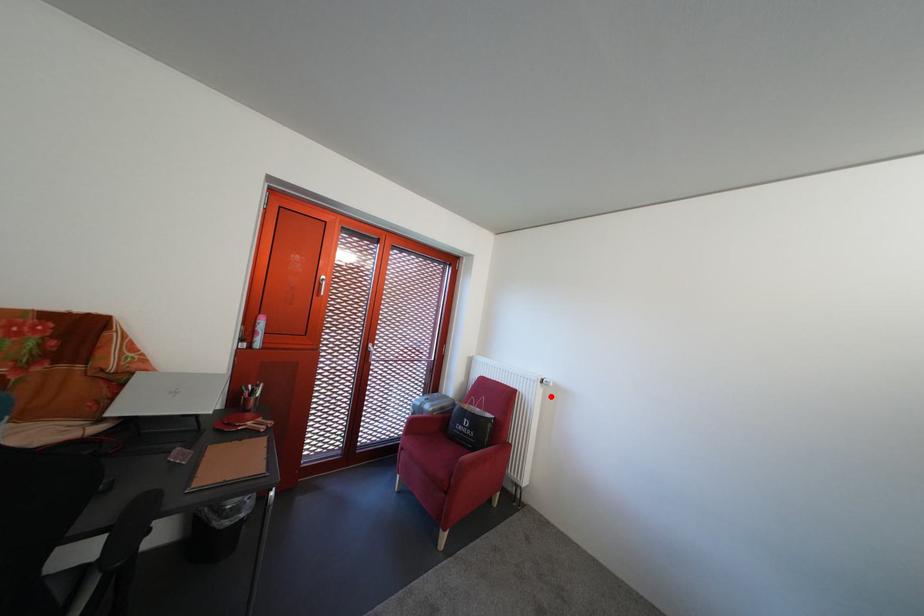
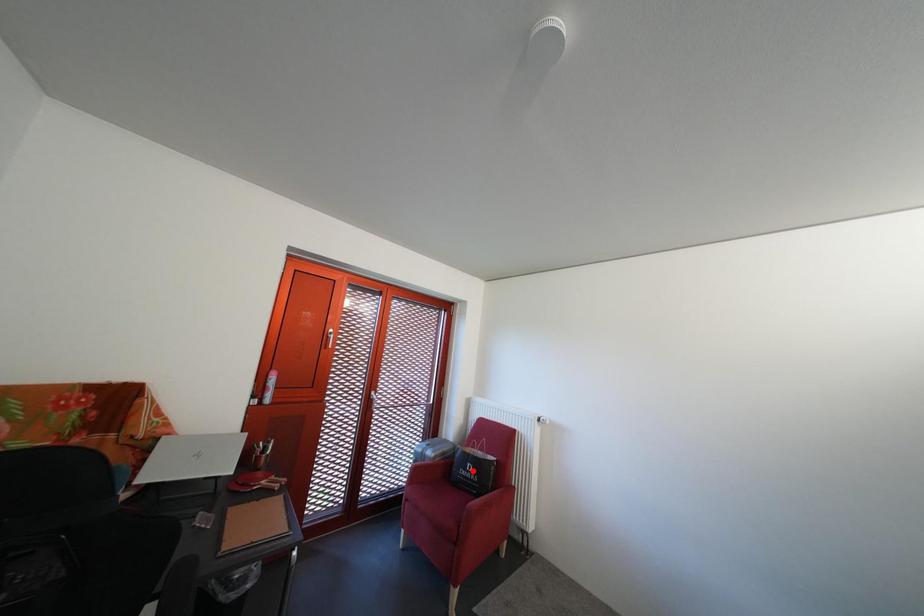
I am providing you with two images of the same scene from different viewpoints. A red point is marked on the first image and another point is marked on the second image. Does the point marked in image1 correspond to the same location as the one in image2?

No